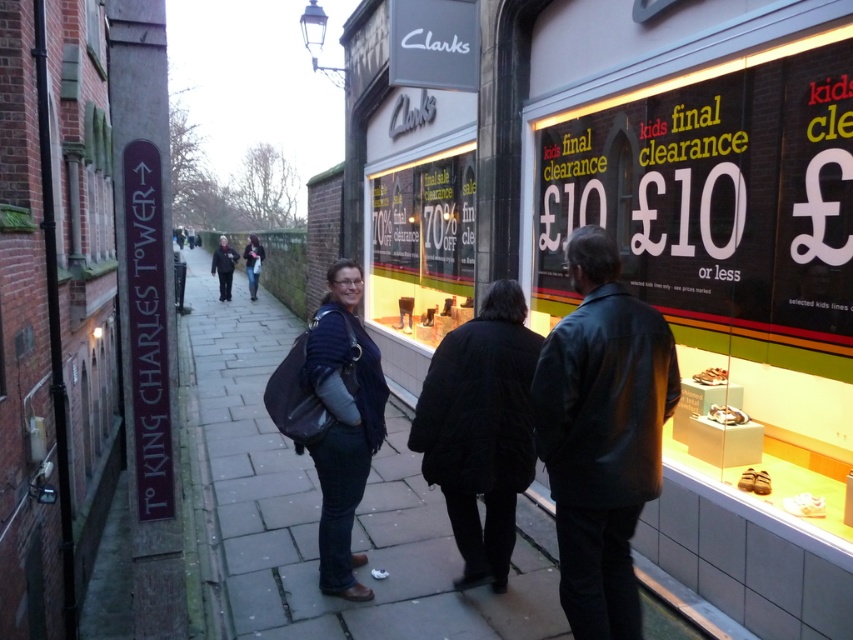
Can you confirm if paved stone sidewalk at center is positioned to the right of dark blue denim jacket at center?

No, paved stone sidewalk at center is not to the right of dark blue denim jacket at center.

Who is higher up, paved stone sidewalk at center or dark blue denim jacket at center?

dark blue denim jacket at center

Where is `paved stone sidewalk at center`? This screenshot has width=853, height=640. paved stone sidewalk at center is located at coordinates (318, 509).

Does leather jacket at center have a greater width compared to clear glass display at center?

No, leather jacket at center is not wider than clear glass display at center.

Which is below, leather jacket at center or clear glass display at center?

leather jacket at center is lower down.

Between point (538, 451) and point (457, 202), which one is positioned behind?

The point (457, 202) is more distant.

Locate an element on the screen. This screenshot has height=640, width=853. leather jacket at center is located at coordinates (601, 433).

Does paved stone sidewalk at center appear under dark blue jacket at center?

Correct, paved stone sidewalk at center is located below dark blue jacket at center.

Who is higher up, paved stone sidewalk at center or dark blue jacket at center?

dark blue jacket at center is above.

Does point (219, 609) come closer to viewer compared to point (254, 253)?

That is True.

At what (x,y) coordinates should I click in order to perform the action: click on paved stone sidewalk at center. Please return your answer as a coordinate pair (x, y). This screenshot has width=853, height=640. Looking at the image, I should click on (318, 509).